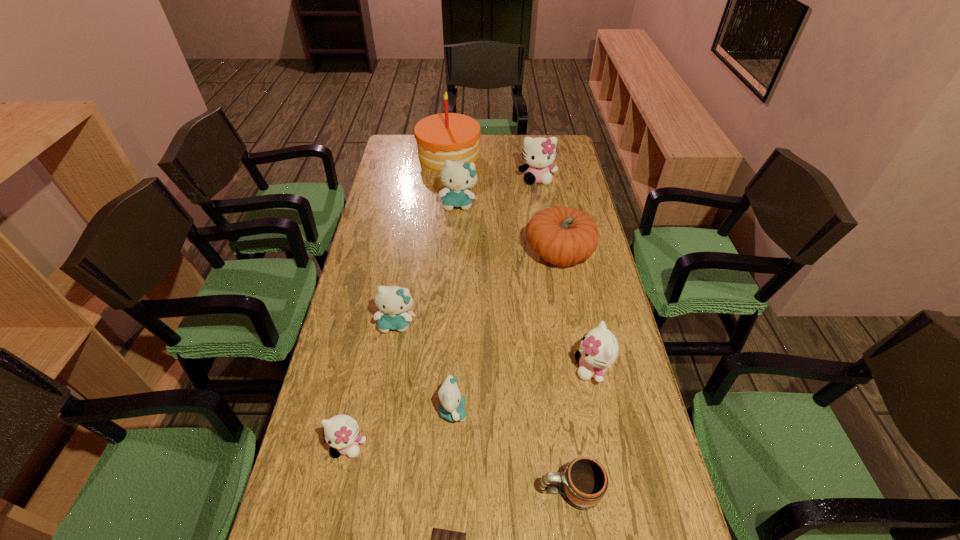
Where is `empty space between the ninth farthest object and the leftmost white kitten`? The image size is (960, 540). empty space between the ninth farthest object and the leftmost white kitten is located at coordinates (459, 468).

Locate an element on the screen. This screenshot has height=540, width=960. free space between the sixth farthest object and the sixth nearest object is located at coordinates coord(494,346).

I want to click on free point between the fourth nearest object and the smallest white kitten, so click(400, 428).

The width and height of the screenshot is (960, 540). I want to click on vacant area between the second nearest object and the tallest object, so click(509, 322).

The image size is (960, 540). Find the location of `vacant point located between the third nearest kitten and the biggest blue kitten`. vacant point located between the third nearest kitten and the biggest blue kitten is located at coordinates (525, 286).

The height and width of the screenshot is (540, 960). I want to click on free spot between the mug and the leftmost blue kitten, so click(x=483, y=407).

You are a GUI agent. You are given a task and a screenshot of the screen. Output one action in this format:
    pyautogui.click(x=<x>, y=<y>)
    Task: Click on the empty space that is in between the fourth nearest kitten and the biggest blue kitten
    This screenshot has height=540, width=960.
    Given the screenshot: What is the action you would take?
    pyautogui.click(x=427, y=264)

Where is `object that is the fourth closest to the seventh nearest object`? The width and height of the screenshot is (960, 540). object that is the fourth closest to the seventh nearest object is located at coordinates (394, 302).

At what (x,y) coordinates should I click in order to perform the action: click on object that stands as the third closest to the farthest white kitten. Please return your answer as a coordinate pair (x, y). The image size is (960, 540). Looking at the image, I should click on (563, 236).

Where is `kitten identified as the fourth closest to the fourth farthest kitten`? This screenshot has width=960, height=540. kitten identified as the fourth closest to the fourth farthest kitten is located at coordinates (457, 176).